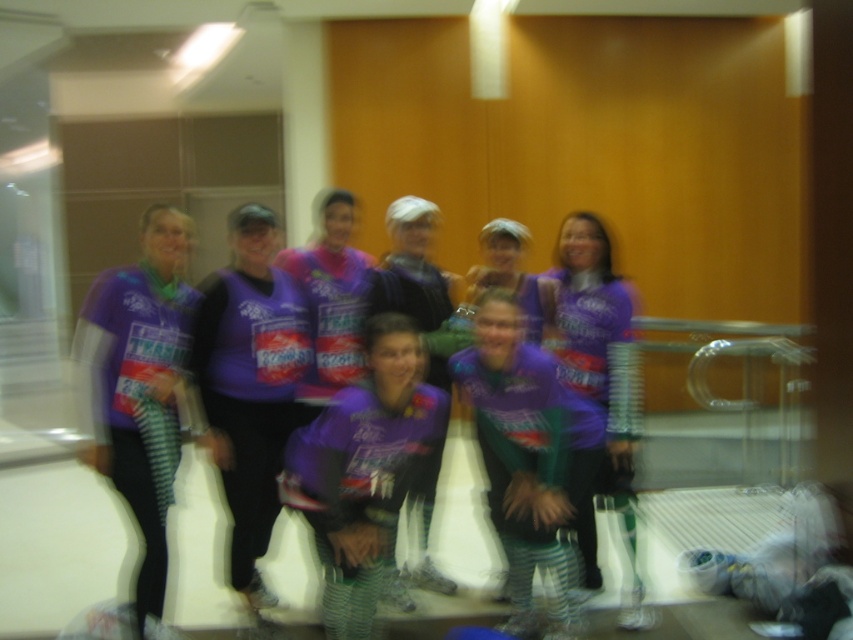
You are standing in the same room as the group and want to take a photo of the purple fabric shirt at center. However, the matte purple shirt at left is blocking your view. Can you move to the right side of the room to get an unobstructed view?

The purple fabric shirt at center is positioned under the matte purple shirt at left, so moving to the right side of the room might allow you to see around or below the matte purple shirt at left to get an unobstructed view of the purple fabric shirt at center.

You are a photographer trying to capture a group photo. You notice two purple clothing items in the frame, the matte purple shirt at left and the purple jersey at center. Which one is located more to the left?

The matte purple shirt at left is more to the left than the purple jersey at center.